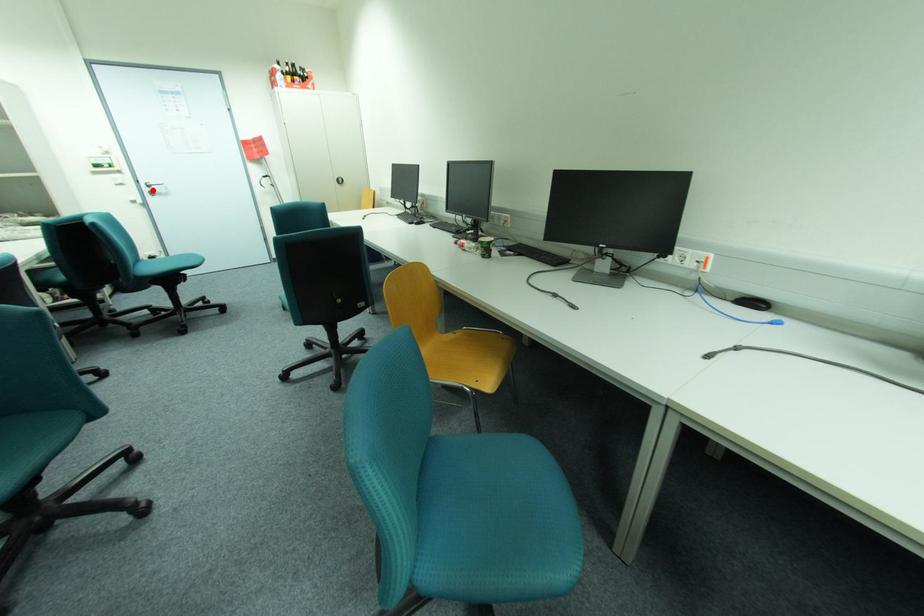
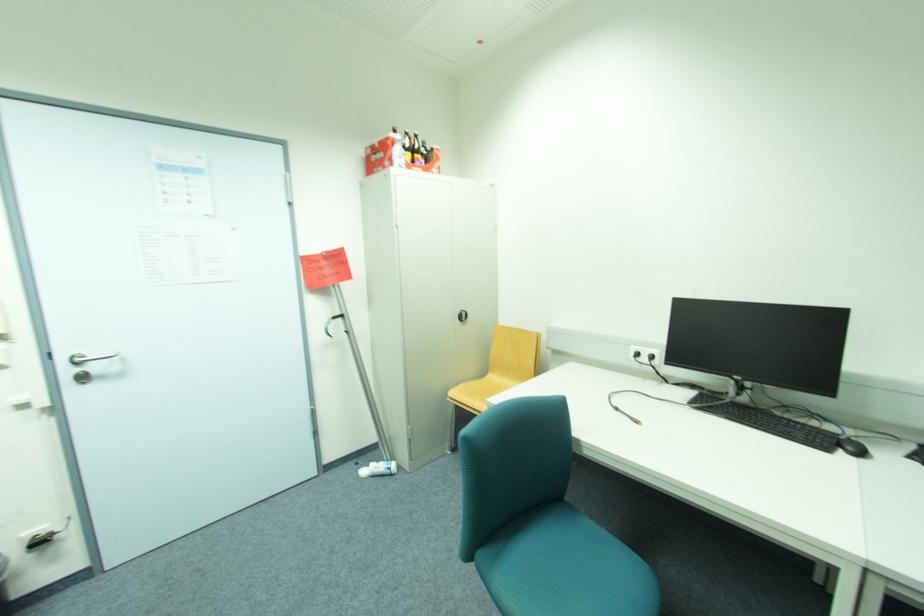
Find the pixel in the second image that matches the highlighted location in the first image.

(74, 371)